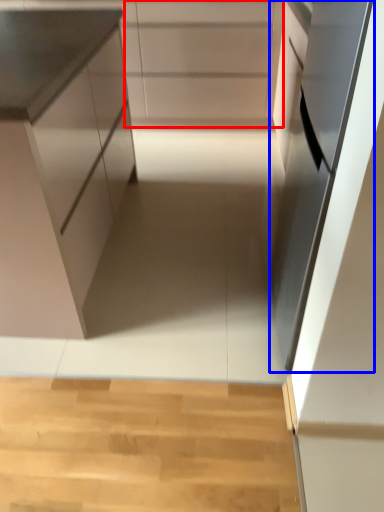
Question: Which point is closer to the camera, cabinetry (highlighted by a red box) or oven (highlighted by a blue box)?

Choices:
 (A) cabinetry
 (B) oven

Answer: (B)